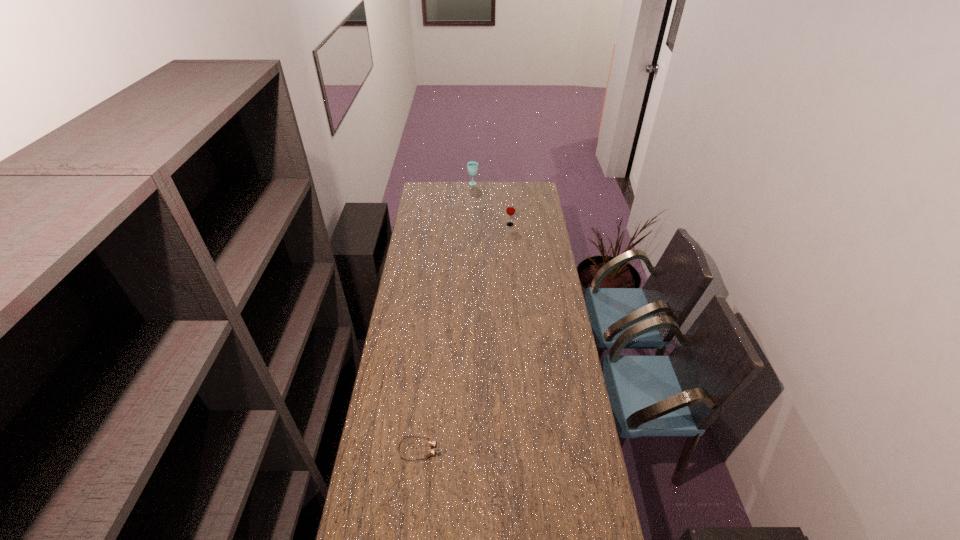
Where is `object that is at the left edge`? The image size is (960, 540). object that is at the left edge is located at coordinates click(432, 443).

I want to click on vacant space at the far edge, so click(450, 181).

In the image, there is a desktop. Find the location of `free space at the left edge`. free space at the left edge is located at coordinates (407, 257).

Where is `free space at the right edge of the desktop`? Image resolution: width=960 pixels, height=540 pixels. free space at the right edge of the desktop is located at coordinates (529, 251).

Find the location of a particular element. This screenshot has height=540, width=960. free spot between the left glass and the shortest object is located at coordinates (446, 317).

Where is `unoccupied position between the right glass and the farther glass`? The width and height of the screenshot is (960, 540). unoccupied position between the right glass and the farther glass is located at coordinates (492, 204).

The image size is (960, 540). I want to click on vacant space that's between the rightmost object and the farthest object, so click(x=492, y=204).

I want to click on empty location between the second object from left to right and the rightmost object, so click(x=492, y=204).

Image resolution: width=960 pixels, height=540 pixels. I want to click on vacant point located between the goggles and the right glass, so click(465, 337).

Image resolution: width=960 pixels, height=540 pixels. Identify the location of object that is the second closest to the right glass. (432, 443).